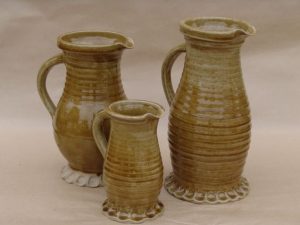
The image size is (300, 225). Find the location of `small pitcher base`. small pitcher base is located at coordinates (146, 211).